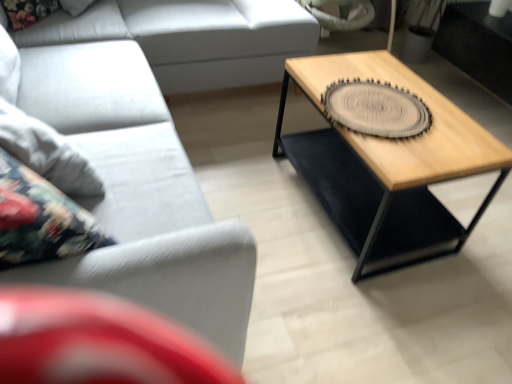
Question: In terms of width, does light gray fabric couch at left, the 1th studio couch positioned from the back, look wider or thinner when compared to wooden/black metal coffee table at right?

Choices:
 (A) wide
 (B) thin

Answer: (A)

Question: Is light gray fabric couch at left, the 1th studio couch positioned from the back, to the left or to the right of wooden/black metal coffee table at right in the image?

Choices:
 (A) right
 (B) left

Answer: (B)

Question: Which object is positioned closest to the light gray fabric couch at left, the 1th studio couch positioned from the back?

Choices:
 (A) matte gray couch at lower left, which ranks as the 1th studio couch in front-to-back order
 (B) gray textured coaster at center right
 (C) wooden/black metal coffee table at right

Answer: (A)

Question: Estimate the real-world distances between objects in this image. Which object is closer to the gray textured coaster at center right?

Choices:
 (A) matte gray couch at lower left, which is the 2th studio couch from back to front
 (B) wooden/black metal coffee table at right
 (C) light gray fabric couch at left, the 1th studio couch positioned from the back

Answer: (B)